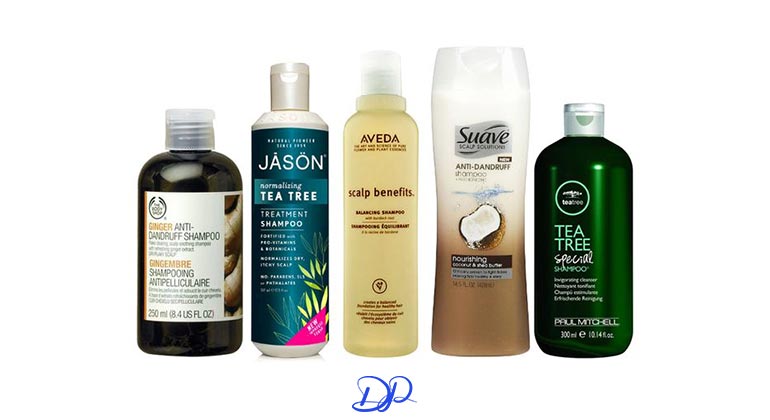
In order to click on shampoo bottles in this screenshot , I will do `click(191, 244)`, `click(293, 224)`, `click(373, 211)`, `click(481, 198)`, `click(581, 225)`.